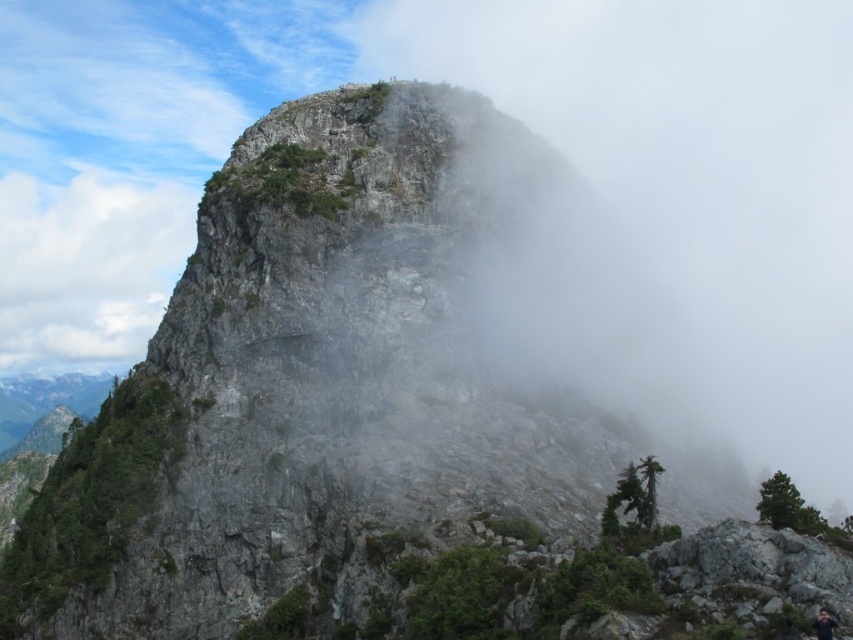
Does white fluffy cloud at upper left have a lesser height compared to dark gray fabric hiker at lower right?

No, white fluffy cloud at upper left is not shorter than dark gray fabric hiker at lower right.

Does white fluffy cloud at upper left have a greater width compared to dark gray fabric hiker at lower right?

Yes.

Locate an element on the screen. white fluffy cloud at upper left is located at coordinates (86, 268).

Which of these two, white misty cloud at upper center or white fluffy cloud at upper left, stands shorter?

With less height is white fluffy cloud at upper left.

Which of these two, white misty cloud at upper center or white fluffy cloud at upper left, stands taller?

Standing taller between the two is white misty cloud at upper center.

This screenshot has width=853, height=640. I want to click on white misty cloud at upper center, so tap(682, 198).

Who is lower down, white misty cloud at upper center or dark gray fabric hiker at lower right?

dark gray fabric hiker at lower right is below.

Who is taller, white misty cloud at upper center or dark gray fabric hiker at lower right?

white misty cloud at upper center is taller.

Find the location of a particular element. This screenshot has width=853, height=640. white misty cloud at upper center is located at coordinates (682, 198).

Locate an element on the screen. The width and height of the screenshot is (853, 640). white misty cloud at upper center is located at coordinates (682, 198).